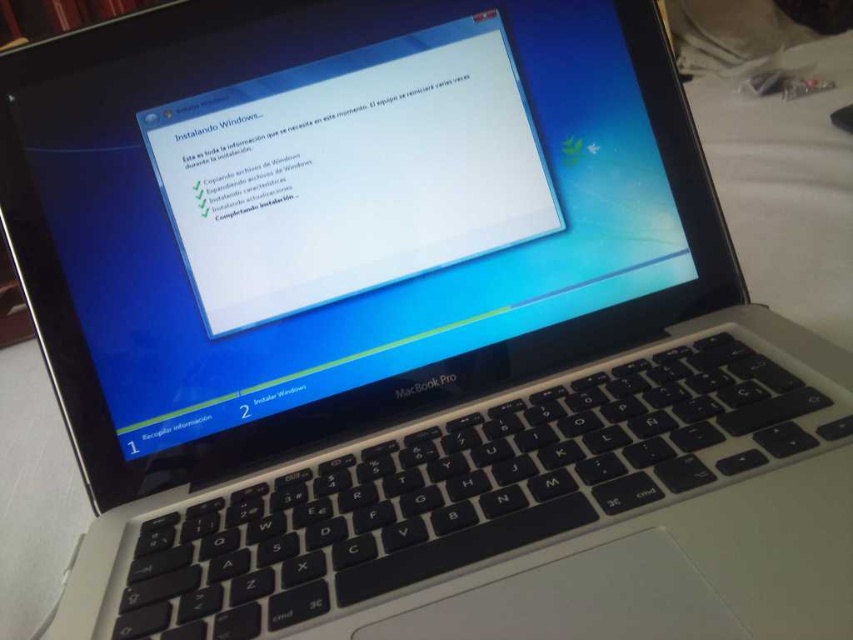
You are trying to install an operating system on your laptop and see the white glossy screen at center and the white fabric at lower right. Which object is located to the left of the other?

The white glossy screen at center is positioned on the left side of white fabric at lower right.

From the picture: You are a technician trying to adjust the screen brightness of the MacBook Pro laptop. The point you need to focus on is point (502,109). Considering the distance of this point from the camera, would you need to use a long or short focal length lens to capture this point clearly?

The point (502,109) is 24.30 inches away from the camera. To capture this point clearly, a short focal length lens would be appropriate since it has a wider field of view, allowing for better focus on objects at closer distances.

You are setting up a new MacBook Pro and need to place a protective white fabric at lower right near the white glossy screen at center. The distance between them must be exactly 16.42 inches. Can you confirm if the current placement meets this requirement?

The white glossy screen at center is 16.42 inches from white fabric at lower right, so yes, the current placement meets the requirement of exactly 16.42 inches between them.